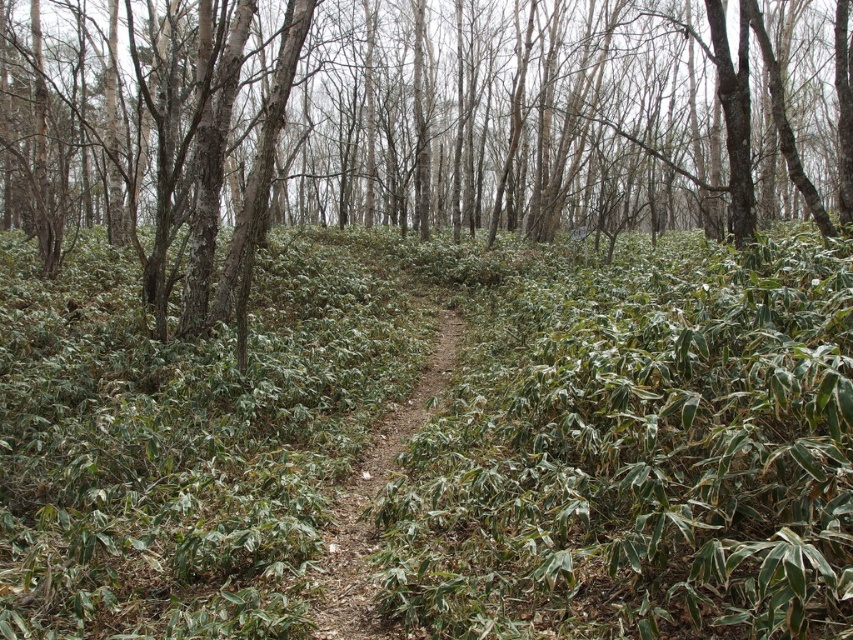
You are a hiker trying to follow the dirt path at center through the forest. There is a green matte tree at center blocking your way. Can you walk around it without leaving the path?

The green matte tree at center is bigger than the dirt path at center, so it might block the path entirely. You may need to detour around it, but staying entirely on the path could be difficult due to the tree size.

From the picture: You are a hiker carrying a backpack and want to walk along the dirt path at center. However, you notice a green matte tree at center nearby. Do you think the tree is wider than the path?

The green matte tree at center might be wider than dirt path at center, so there is a possibility that the tree is wider than the path. You should check the width before proceeding.